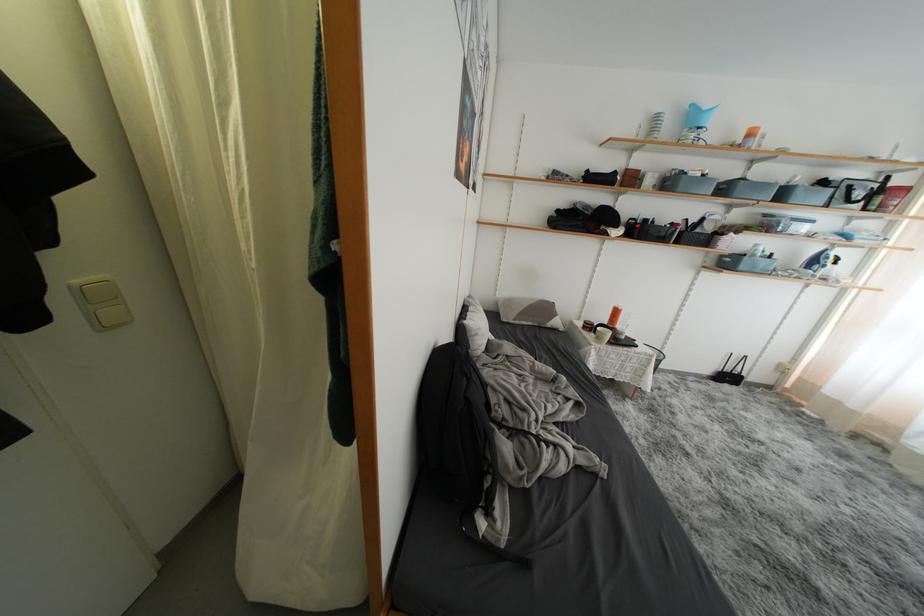
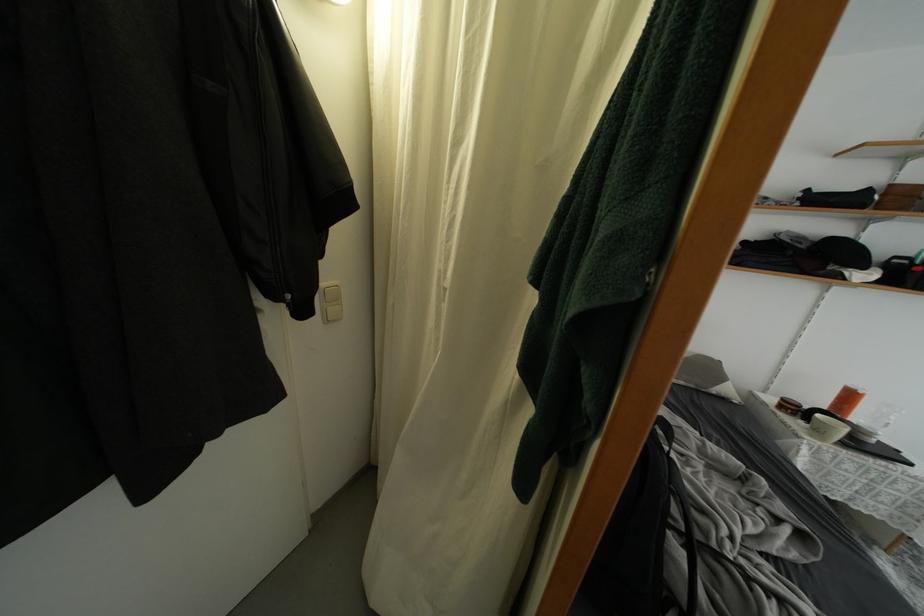
The point at (604, 342) is marked in the first image. Where is the corresponding point in the second image?

(823, 437)